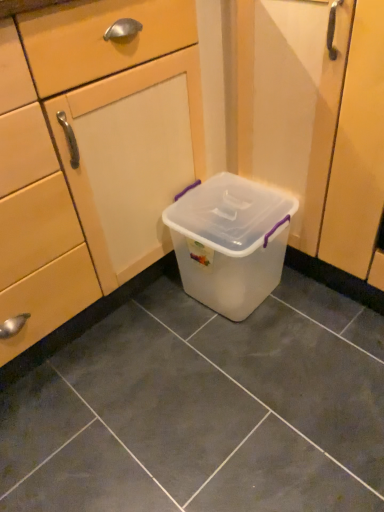
Question: Does translucent plastic container at center touch transparent plastic container at center?

Choices:
 (A) yes
 (B) no

Answer: (B)

Question: From a real-world perspective, is translucent plastic container at center over transparent plastic container at center?

Choices:
 (A) yes
 (B) no

Answer: (B)

Question: Is there a large distance between translucent plastic container at center and transparent plastic container at center?

Choices:
 (A) no
 (B) yes

Answer: (A)

Question: Does translucent plastic container at center lie in front of transparent plastic container at center?

Choices:
 (A) no
 (B) yes

Answer: (A)

Question: Can you confirm if translucent plastic container at center is taller than transparent plastic container at center?

Choices:
 (A) yes
 (B) no

Answer: (B)

Question: From a real-world perspective, relative to transparent plastic container at center, is translucent plastic container at center vertically above or below?

Choices:
 (A) above
 (B) below

Answer: (B)

Question: Considering their positions, is translucent plastic container at center located in front of or behind transparent plastic container at center?

Choices:
 (A) front
 (B) behind

Answer: (B)

Question: Is translucent plastic container at center bigger or smaller than transparent plastic container at center?

Choices:
 (A) big
 (B) small

Answer: (B)

Question: Would you say translucent plastic container at center is to the left or to the right of transparent plastic container at center in the picture?

Choices:
 (A) right
 (B) left

Answer: (A)

Question: Is transparent plastic container at center bigger or smaller than transparent plastic storage box at center?

Choices:
 (A) small
 (B) big

Answer: (B)

Question: From the image's perspective, is transparent plastic container at center positioned above or below transparent plastic storage box at center?

Choices:
 (A) above
 (B) below

Answer: (A)

Question: From a real-world perspective, is transparent plastic container at center physically located above or below transparent plastic storage box at center?

Choices:
 (A) below
 (B) above

Answer: (B)

Question: In terms of width, does transparent plastic container at center look wider or thinner when compared to transparent plastic storage box at center?

Choices:
 (A) thin
 (B) wide

Answer: (B)

Question: Does point (38, 108) appear closer or farther from the camera than point (155, 409)?

Choices:
 (A) closer
 (B) farther

Answer: (A)

Question: Visually, is transparent plastic container at center positioned to the left or to the right of translucent plastic container at center?

Choices:
 (A) left
 (B) right

Answer: (A)